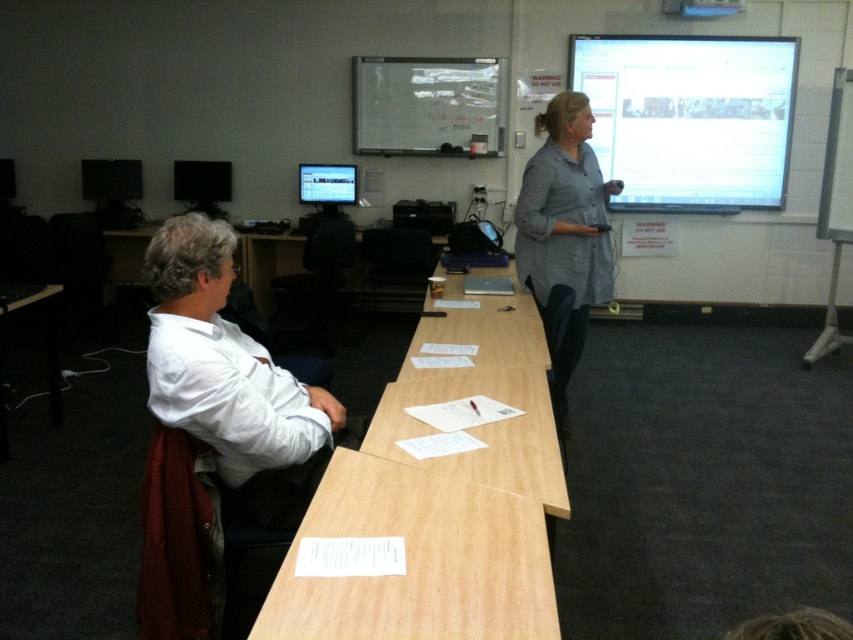
You are a student who needs to place a 1.2 meter tall poster on the light brown wood table at center or the matte black monitor at left. Which surface can accommodate the poster without it exceeding the height of the surface?

The matte black monitor at left is taller than the light brown wood table at center. Since the poster is 1.2 meters tall, it would exceed the height of the table but might fit on the monitor if the monitor is taller than 1.2 meters. However, the description only states the monitor is taller than the table, not the exact height. Therefore, without knowing the exact height of the monitor, we cannot confirm if it can accommodate the poster.

You are a student in the classroom and need to place a textbook on the light brown wood table at center so it can be seen by everyone. Considering their heights, will the whiteboard at upper center block the view of the textbook from the back of the room?

The light brown wood table at center has a lesser height compared to whiteboard at upper center, so the whiteboard at upper center may block the view of the textbook placed on the table from the back of the room.

You are a student entering the classroom and need to reach the whiteboard at upper center. There is a light brown wood table at center in your way. Can you walk around the table to reach the whiteboard?

The light brown wood table at center is to the right of the whiteboard at upper center, so you can walk around the left side of the table to reach the whiteboard.